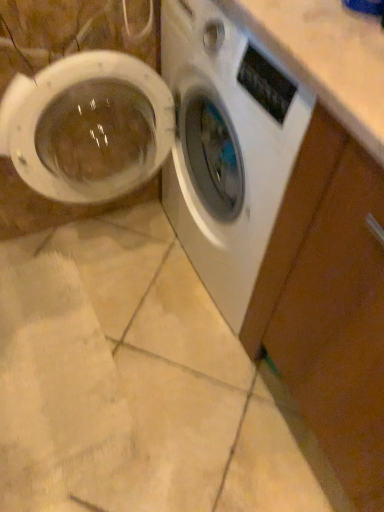
Measure the distance between point (198, 159) and camera.

Point (198, 159) and camera are 4.02 feet apart.

This screenshot has height=512, width=384. What do you see at coordinates (170, 140) in the screenshot?
I see `white glossy washing machine at center` at bounding box center [170, 140].

I want to click on white glossy washing machine at center, so click(x=170, y=140).

The image size is (384, 512). Find the location of `white glossy washing machine at center`. white glossy washing machine at center is located at coordinates (170, 140).